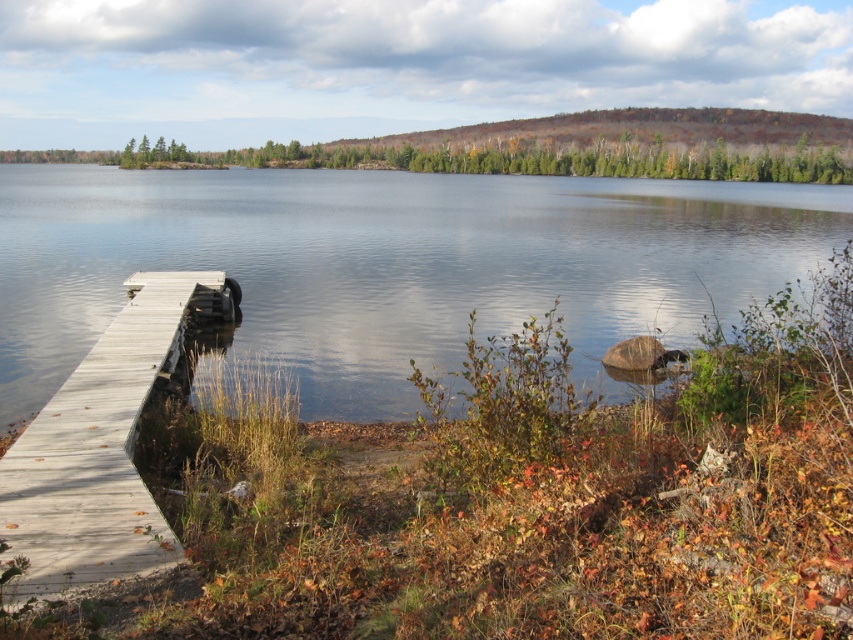
You are standing at the lakeside and want to know which object in the scene is larger when viewed from above. Which one is bigger between the transparent water at center and the light gray wooden dock at lower left?

The transparent water at center is bigger than the light gray wooden dock at lower left according to the description provided.